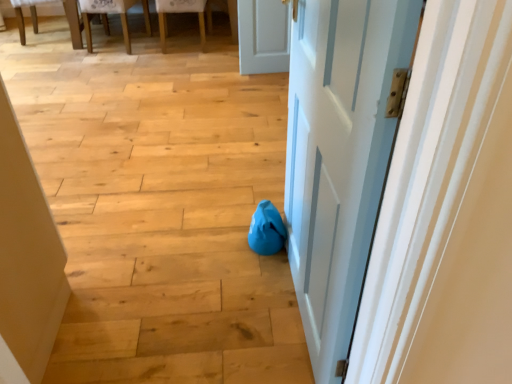
Find the location of `free area in between wooden textured chair at upper left, the 2th chair viewed from the right, and white painted wood door at center`. free area in between wooden textured chair at upper left, the 2th chair viewed from the right, and white painted wood door at center is located at coordinates (178, 127).